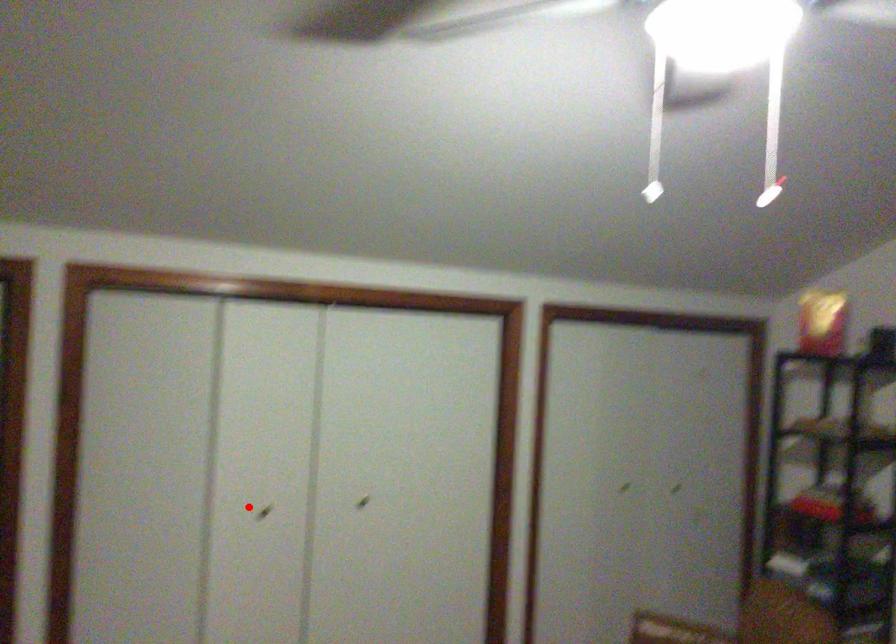
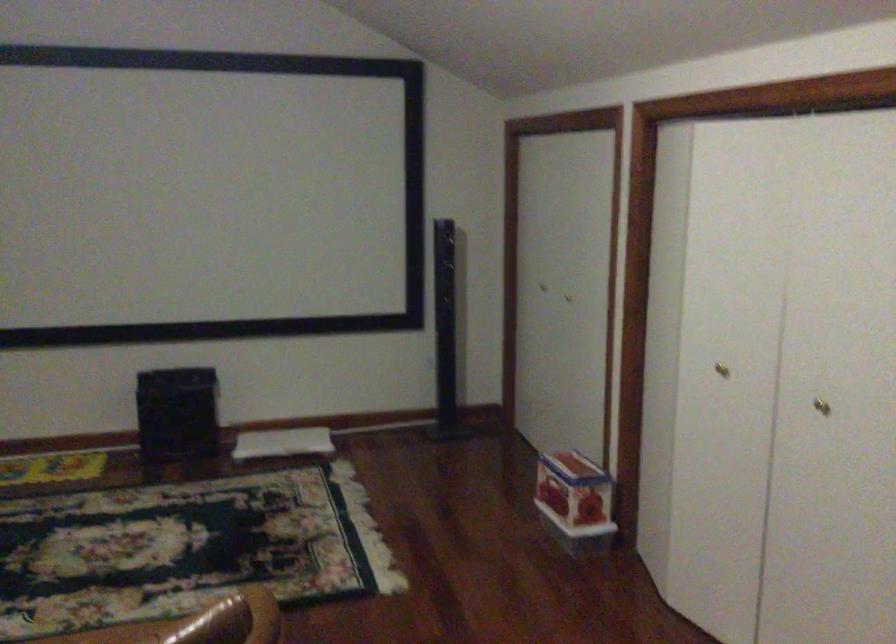
Locate, in the second image, the point that corresponds to the highlighted location in the first image.

(721, 368)